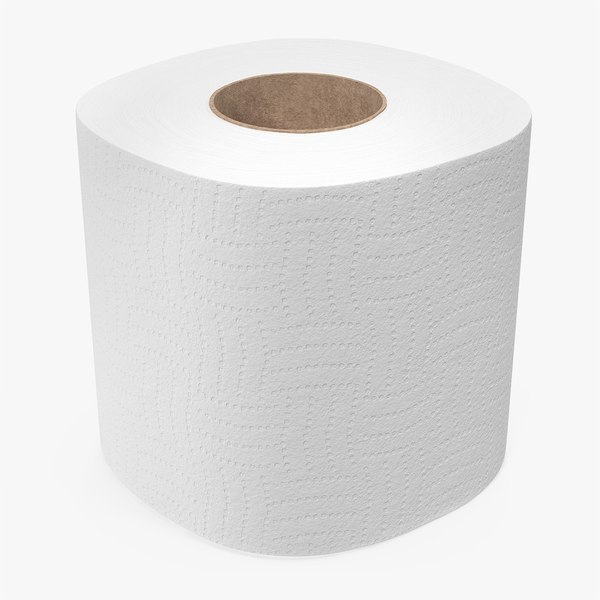
This screenshot has height=600, width=600. Find the location of `three vertical lines of circular pattern on toilet paper`. three vertical lines of circular pattern on toilet paper is located at coordinates (287, 234), (311, 235), (336, 233), (289, 315), (311, 312), (337, 313), (281, 274), (306, 276), (329, 273).